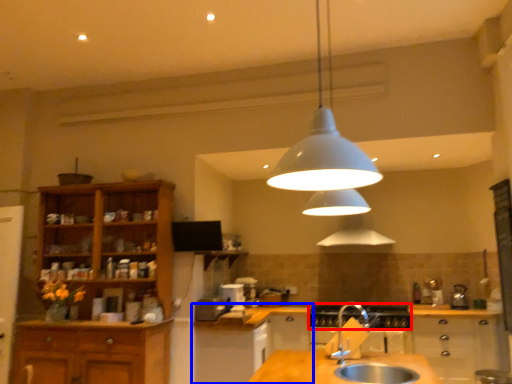
Question: Which object appears farthest to the camera in this image, gas stove (highlighted by a red box) or cabinetry (highlighted by a blue box)?

Choices:
 (A) gas stove
 (B) cabinetry

Answer: (A)